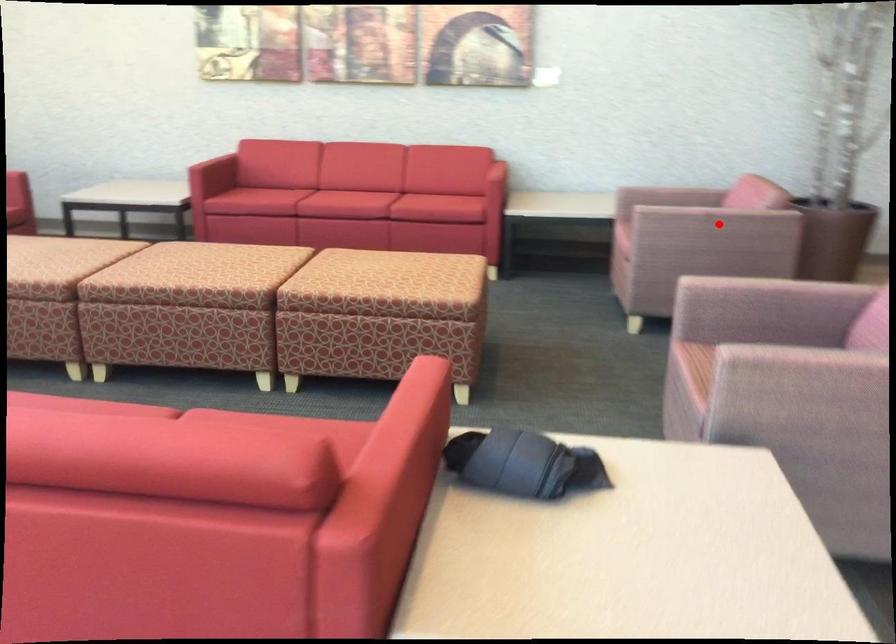
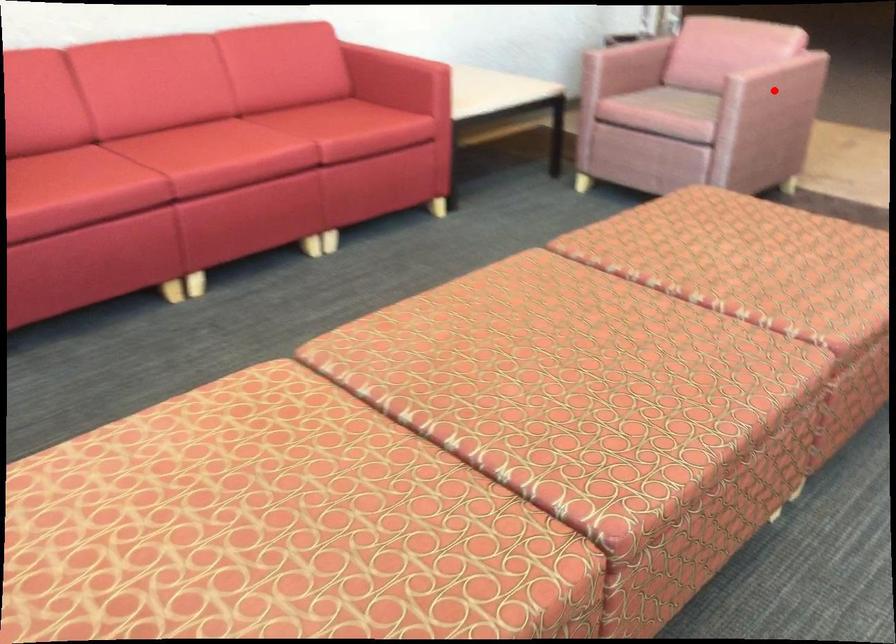
I am providing you with two images of the same scene from different viewpoints. A red point is marked on the first image and another point is marked on the second image. Does the point marked in image1 correspond to the same location as the one in image2?

Yes